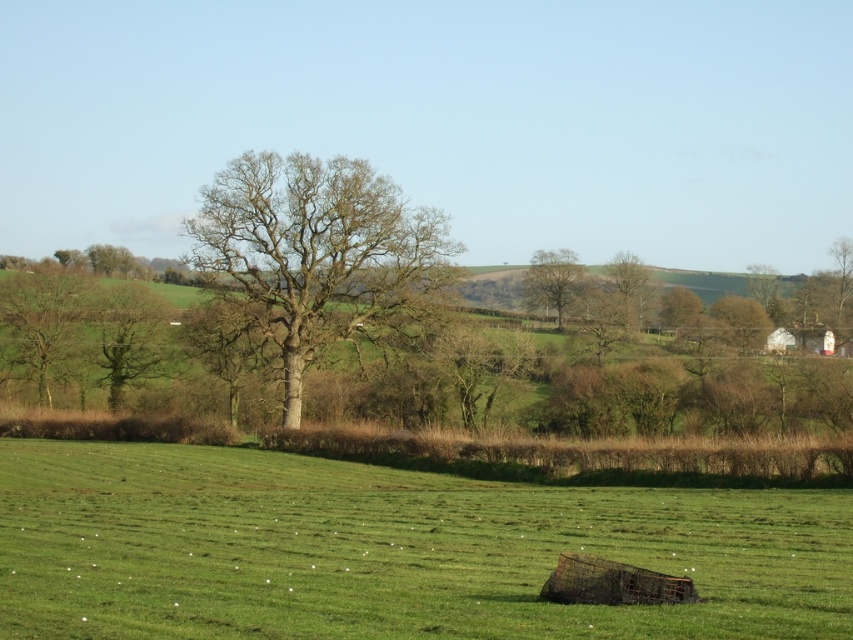
Can you confirm if green grassy pasture at lower center is taller than green leafy tree at center?

No.

Can you confirm if green grassy pasture at lower center is positioned to the right of green leafy tree at center?

In fact, green grassy pasture at lower center is to the left of green leafy tree at center.

Which is in front, point (173, 506) or point (561, 275)?

Point (173, 506)

Where is `green grassy pasture at lower center`? green grassy pasture at lower center is located at coordinates (387, 548).

This screenshot has height=640, width=853. Describe the element at coordinates (387, 548) in the screenshot. I see `green grassy pasture at lower center` at that location.

Is green grassy pasture at lower center bigger than green leafy tree at left?

Yes, green grassy pasture at lower center is bigger than green leafy tree at left.

The height and width of the screenshot is (640, 853). Find the location of `green grassy pasture at lower center`. green grassy pasture at lower center is located at coordinates (387, 548).

Between green leafy tree at left and green leafy tree at center, which one is positioned higher?

green leafy tree at center is higher up.

Is green leafy tree at left taller than green leafy tree at center?

Correct, green leafy tree at left is much taller as green leafy tree at center.

Between point (0, 337) and point (573, 284), which one is positioned behind?

Point (573, 284)

Find the location of a particular element. Image resolution: width=853 pixels, height=640 pixels. green leafy tree at left is located at coordinates (42, 324).